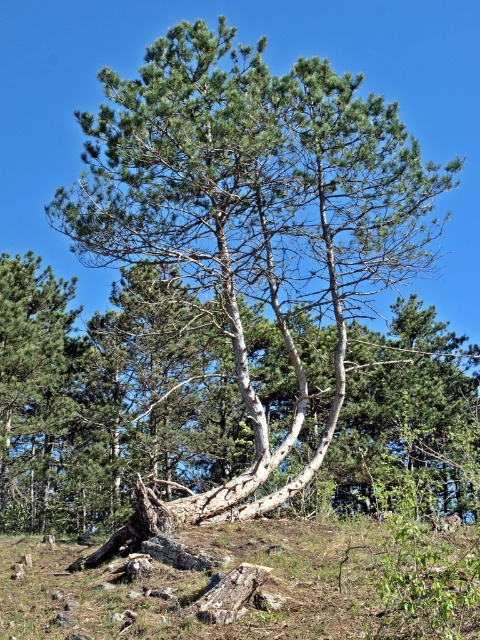
Question: Which point is closer to the camera?

Choices:
 (A) brown rough tree stump at center
 (B) smooth white bark tree at center
 (C) smooth white tree trunk at center

Answer: (A)

Question: Estimate the real-world distances between objects in this image. Which object is farther from the smooth white bark tree at center?

Choices:
 (A) smooth white tree trunk at center
 (B) brown rough tree stump at center

Answer: (B)

Question: Which point is farther from the camera taking this photo?

Choices:
 (A) (171, 492)
 (B) (424, 589)

Answer: (A)

Question: Can you confirm if smooth white bark tree at center is positioned to the left of smooth white tree trunk at center?

Choices:
 (A) yes
 (B) no

Answer: (A)

Question: Can you confirm if smooth white bark tree at center is positioned below brown rough tree stump at center?

Choices:
 (A) yes
 (B) no

Answer: (B)

Question: Is smooth white tree trunk at center below brown rough tree stump at center?

Choices:
 (A) no
 (B) yes

Answer: (A)